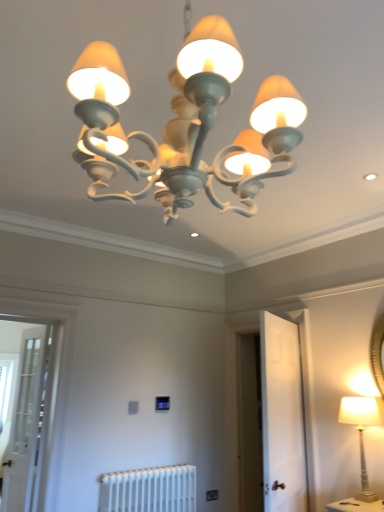
Question: In which direction should I rotate to look at white matte door at center, which ranks as the 2th screen door in left-to-right order?

Choices:
 (A) right
 (B) left

Answer: (A)

Question: From a real-world perspective, is white painted wood lamp at right, marked as the 1th lamp in a bottom-to-top arrangement, on top of white matte door at center, the 1th screen door viewed from the right?

Choices:
 (A) no
 (B) yes

Answer: (A)

Question: Is white painted wood lamp at right, the first lamp positioned from the right, in front of white matte door at center, the 1th screen door viewed from the right?

Choices:
 (A) no
 (B) yes

Answer: (A)

Question: Is white painted wood lamp at right, the second lamp viewed from the top, at the left side of white matte door at center, which ranks as the 2th screen door in left-to-right order?

Choices:
 (A) no
 (B) yes

Answer: (A)

Question: Considering the relative sizes of white painted wood lamp at right, the second lamp viewed from the front, and white matte door at center, the 1th screen door viewed from the right, in the image provided, is white painted wood lamp at right, the second lamp viewed from the front, taller than white matte door at center, the 1th screen door viewed from the right,?

Choices:
 (A) yes
 (B) no

Answer: (B)

Question: Does white painted wood lamp at right, marked as the 1th lamp in a bottom-to-top arrangement, have a lesser height compared to white matte door at center, the 1th screen door viewed from the right?

Choices:
 (A) yes
 (B) no

Answer: (A)

Question: Is the surface of white painted wood lamp at right, which is the second lamp in left-to-right order, in direct contact with white matte door at center, which ranks as the 2th screen door in left-to-right order?

Choices:
 (A) yes
 (B) no

Answer: (B)

Question: Does matte white chandelier at upper center, marked as the 1th lamp in a front-to-back arrangement, turn towards white metallic radiator at lower center?

Choices:
 (A) yes
 (B) no

Answer: (B)

Question: Can you confirm if matte white chandelier at upper center, placed as the second lamp when sorted from back to front, is thinner than white metallic radiator at lower center?

Choices:
 (A) no
 (B) yes

Answer: (A)

Question: Can you confirm if matte white chandelier at upper center, placed as the second lamp when sorted from back to front, is bigger than white metallic radiator at lower center?

Choices:
 (A) no
 (B) yes

Answer: (B)

Question: Does matte white chandelier at upper center, which ranks as the first lamp in top-to-bottom order, appear on the left side of white metallic radiator at lower center?

Choices:
 (A) no
 (B) yes

Answer: (A)

Question: Can white metallic radiator at lower center be found inside matte white chandelier at upper center, which is the second lamp in bottom-to-top order?

Choices:
 (A) no
 (B) yes

Answer: (A)

Question: Is matte white chandelier at upper center, which is the second lamp in bottom-to-top order, closer to camera compared to white metallic radiator at lower center?

Choices:
 (A) yes
 (B) no

Answer: (A)

Question: From a real-world perspective, is white painted wood lamp at right, the second lamp viewed from the front, located beneath white metallic radiator at lower center?

Choices:
 (A) no
 (B) yes

Answer: (A)